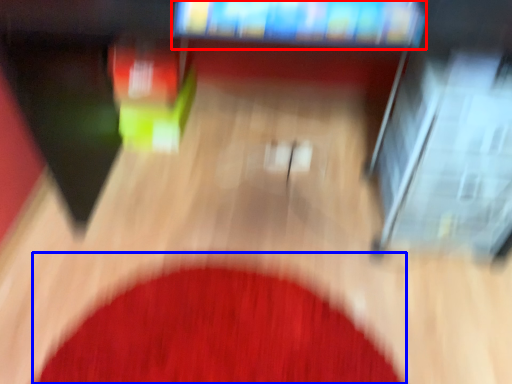
Question: Which object is further to the camera taking this photo, television (highlighted by a red box) or mat (highlighted by a blue box)?

Choices:
 (A) television
 (B) mat

Answer: (B)